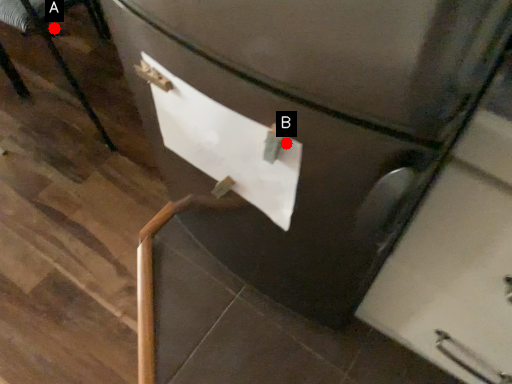
Question: Two points are circled on the image, labeled by A and B beside each circle. Which point is closer to the camera?

Choices:
 (A) A is closer
 (B) B is closer

Answer: (B)